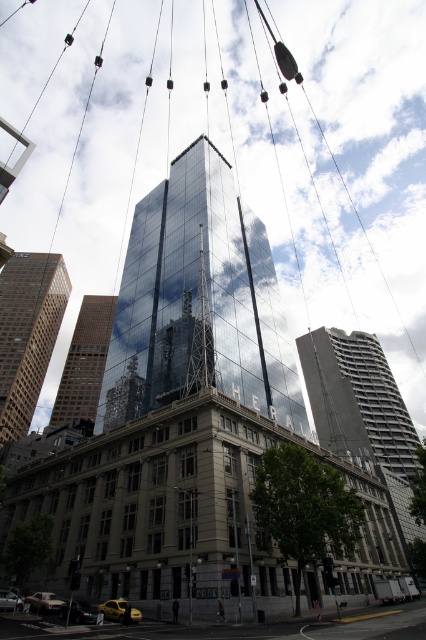
You are standing at the base of the modern glass skyscraper and want to take a photo of the yellow taxi. There are two points marked in the image. The first point is at coordinate point (164, 330), and the second point is at coordinate point (34, 404). Which point should you aim your camera at to capture the yellow taxi in the foreground without it being obscured by the older building?

You should aim your camera at point (164, 330) because it is in front of point (34, 404), meaning the yellow taxi would be closer to the camera and less likely to be blocked by the older building in the foreground.

You are an architect analyzing the urban skyline. You observe the reflective glass tower at center and the smooth glass building at center. Which of these two structures has a narrower width when viewed from this perspective?

The reflective glass tower at center is thinner than the smooth glass building at center, so it has a narrower width when viewed from this perspective.

You are a city planner assessing the skyline. You need to determine which of the two buildings, the reflective glass tower at center or the brown glass skyscraper at left, is shorter. Based on the scene, which one is shorter?

The reflective glass tower at center is shorter than the brown glass skyscraper at left.